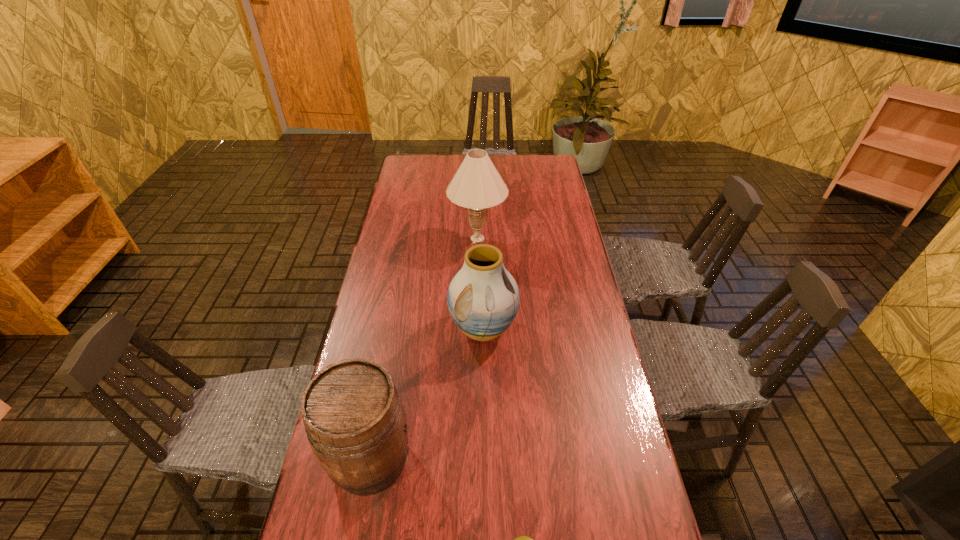
Where is `lampshade`? lampshade is located at coordinates (477, 185).

Locate an element on the screen. The width and height of the screenshot is (960, 540). the farthest object is located at coordinates (477, 185).

Locate an element on the screen. This screenshot has width=960, height=540. vase is located at coordinates click(483, 298).

Locate an element on the screen. The image size is (960, 540). the leftmost object is located at coordinates (355, 422).

Where is `the second nearest object`? The width and height of the screenshot is (960, 540). the second nearest object is located at coordinates (355, 422).

You are a GUI agent. You are given a task and a screenshot of the screen. Output one action in this format:
    pyautogui.click(x=<x>, y=<y>)
    Task: Click on the vacant space located 0.380m on the back of the lampshade
    The height and width of the screenshot is (540, 960).
    Given the screenshot: What is the action you would take?
    pyautogui.click(x=478, y=173)

The image size is (960, 540). Identify the location of blank space located on the left of the third nearest object. (358, 328).

Where is `vacant space located 0.060m on the side of the cider near the bung hole`? The height and width of the screenshot is (540, 960). vacant space located 0.060m on the side of the cider near the bung hole is located at coordinates (439, 459).

Where is `object present at the left edge`? object present at the left edge is located at coordinates (355, 422).

Where is `vacant region at the far edge of the desktop`? vacant region at the far edge of the desktop is located at coordinates (463, 158).